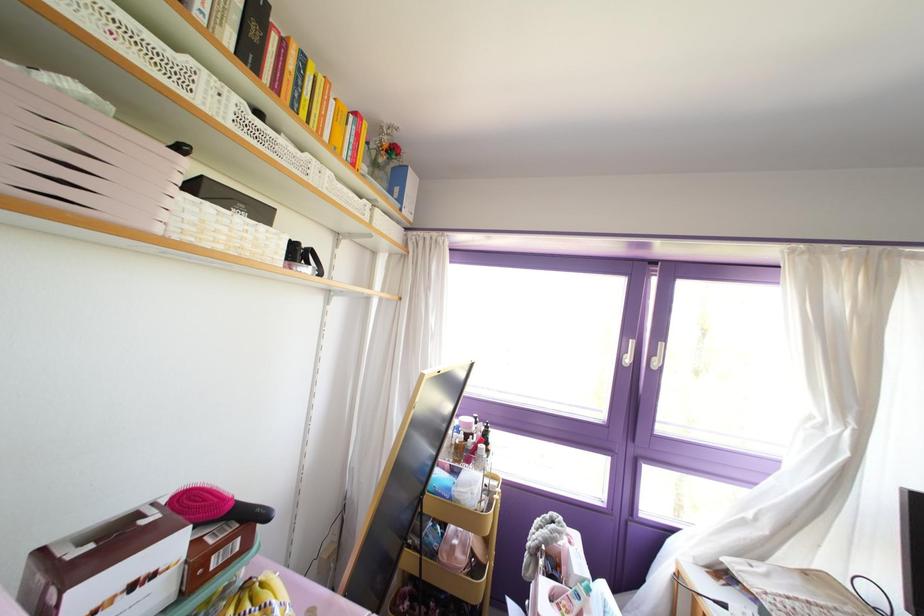
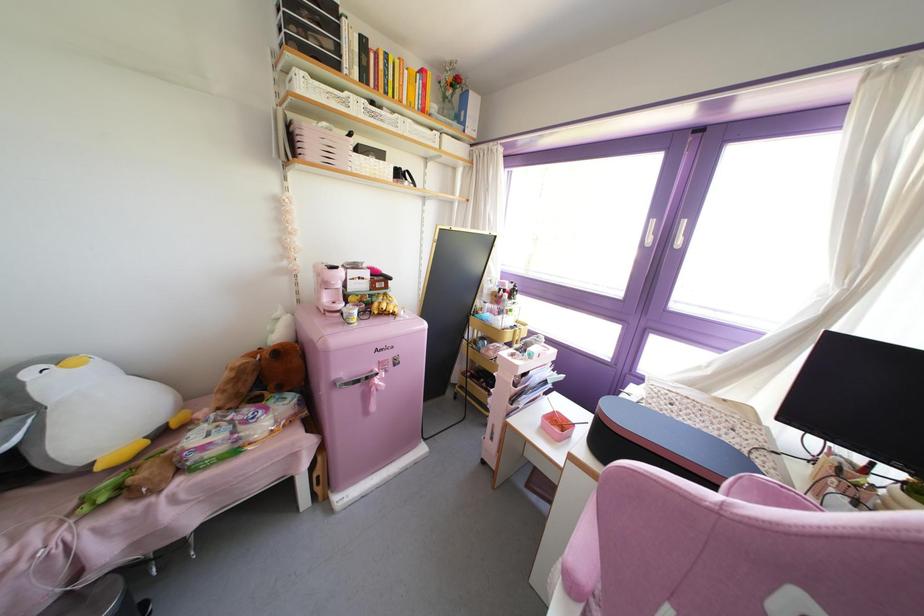
Where in the second image is the point corresponding to (287,77) from the first image?

(381, 74)